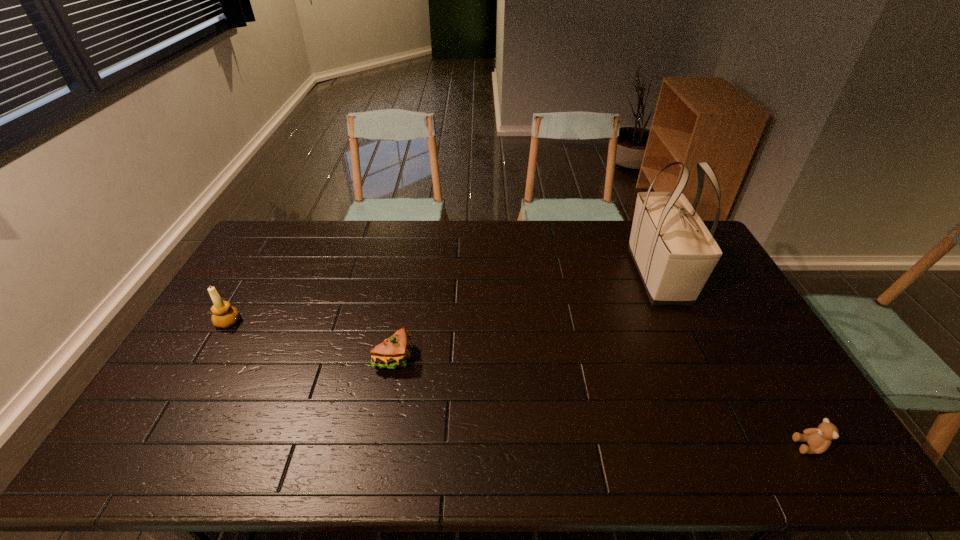
The width and height of the screenshot is (960, 540). I want to click on vacant space located on the back of the third farthest object, so click(411, 267).

Locate an element on the screen. The height and width of the screenshot is (540, 960). vacant space located on the face of the shortest object is located at coordinates (771, 446).

Find the location of `vacant area situated on the face of the shortest object`. vacant area situated on the face of the shortest object is located at coordinates pyautogui.click(x=635, y=446).

Image resolution: width=960 pixels, height=540 pixels. I want to click on blank area located 0.340m on the face of the shortest object, so click(656, 446).

Image resolution: width=960 pixels, height=540 pixels. Identify the location of object present at the far edge. (674, 252).

Where is `object present at the near edge`? The width and height of the screenshot is (960, 540). object present at the near edge is located at coordinates (819, 439).

Where is `object that is at the left edge`? The image size is (960, 540). object that is at the left edge is located at coordinates (224, 315).

Locate an element on the screen. The width and height of the screenshot is (960, 540). shopping bag situated at the right edge is located at coordinates (674, 252).

I want to click on teddy bear present at the right edge, so click(x=819, y=439).

Locate an element on the screen. The image size is (960, 540). object that is at the far right corner is located at coordinates (674, 252).